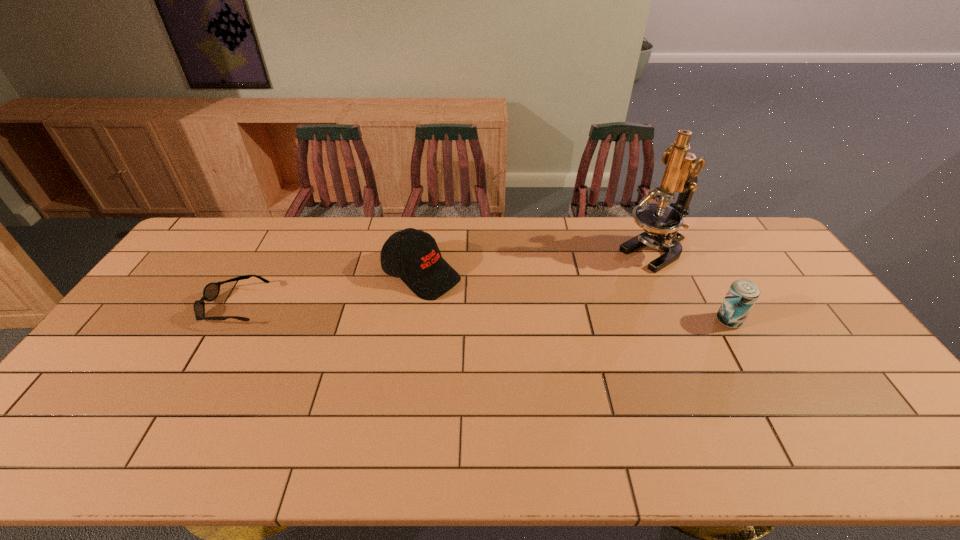
Locate an element on the screen. This screenshot has height=540, width=960. empty space that is in between the tallest object and the beer can is located at coordinates (692, 287).

Locate an element on the screen. The height and width of the screenshot is (540, 960). vacant region between the beer can and the shortest object is located at coordinates pos(482,314).

Locate an element on the screen. The height and width of the screenshot is (540, 960). free spot between the beer can and the baseball cap is located at coordinates (575, 298).

At what (x,y) coordinates should I click in order to perform the action: click on free space that is in between the tallest object and the beer can. Please return your answer as a coordinate pair (x, y). Image resolution: width=960 pixels, height=540 pixels. Looking at the image, I should click on pyautogui.click(x=692, y=287).

Identify the location of free space between the beer can and the baseball cap. This screenshot has width=960, height=540. (575, 298).

Locate an element on the screen. This screenshot has width=960, height=540. unoccupied position between the third object from right to left and the sunglasses is located at coordinates (328, 291).

At what (x,y) coordinates should I click in order to perform the action: click on free spot between the baseball cap and the beer can. Please return your answer as a coordinate pair (x, y). The height and width of the screenshot is (540, 960). Looking at the image, I should click on (575, 298).

Identify the location of free spot between the beer can and the microscope. (692, 287).

In order to click on free space between the second object from left to right and the microscope in this screenshot , I will do `click(539, 264)`.

I want to click on blank region between the microscope and the third object from right to left, so [x=539, y=264].